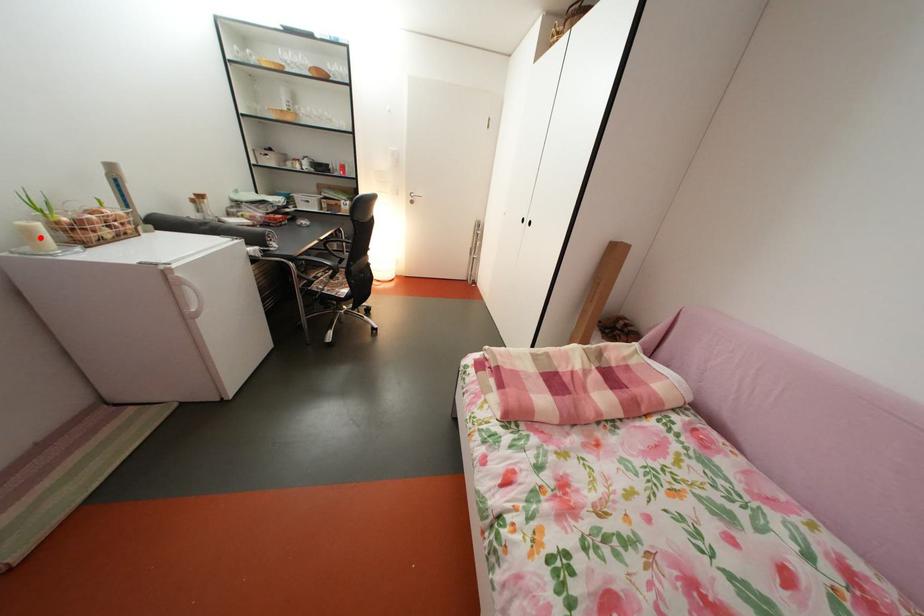
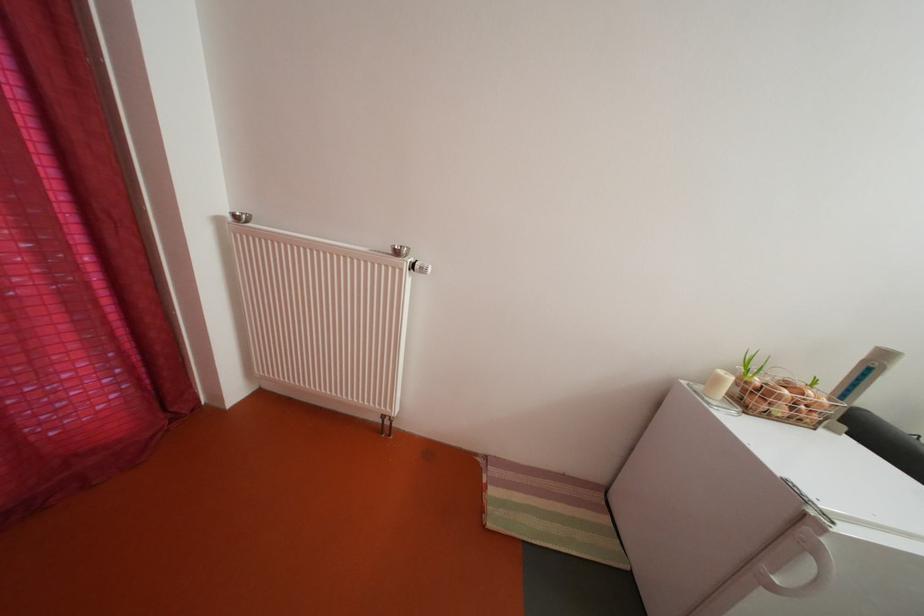
In the second image, find the point that corresponds to the highlighted location in the first image.

(728, 386)